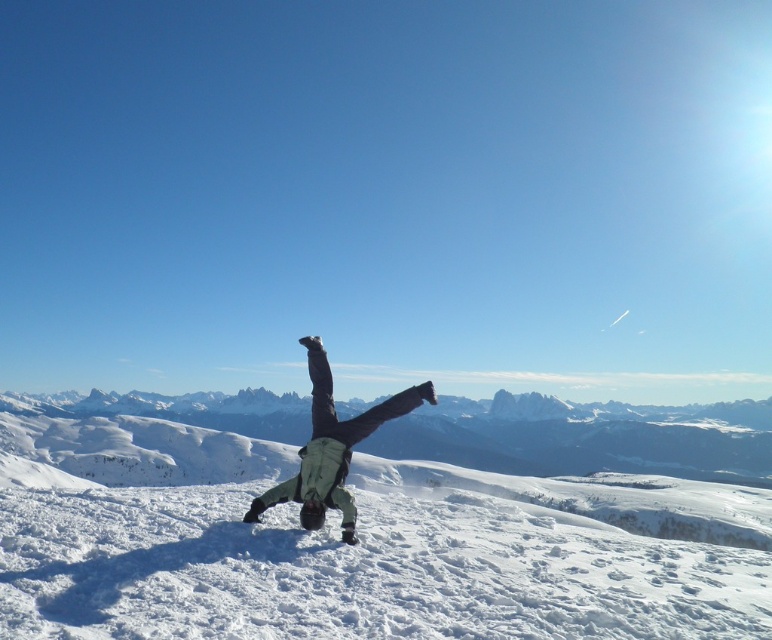
Question: Can you confirm if white powdery snow at center is positioned below light green fabric pants at center?

Choices:
 (A) no
 (B) yes

Answer: (B)

Question: In this image, where is snowy mountain at center located relative to light green fabric pants at center?

Choices:
 (A) left
 (B) right

Answer: (A)

Question: Which of the following is the closest to the observer?

Choices:
 (A) snowy mountain at center
 (B) light green fabric pants at center
 (C) white powdery snow at center

Answer: (C)

Question: Is snowy mountain at center closer to camera compared to light green fabric pants at center?

Choices:
 (A) yes
 (B) no

Answer: (B)

Question: Among these objects, which one is nearest to the camera?

Choices:
 (A) snowy mountain at center
 (B) white powdery snow at center

Answer: (B)

Question: Which object appears farthest from the camera in this image?

Choices:
 (A) white powdery snow at center
 (B) snowy mountain at center
 (C) light green fabric pants at center

Answer: (B)